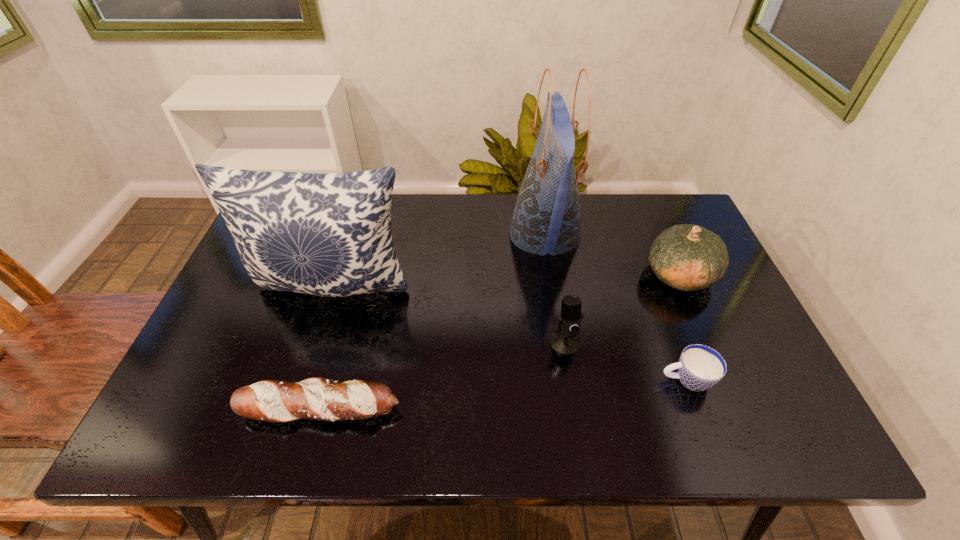
At what (x,y) coordinates should I click in order to perform the action: click on shopping bag. Please return your answer as a coordinate pair (x, y). Looking at the image, I should click on (546, 219).

The height and width of the screenshot is (540, 960). I want to click on cushion, so click(328, 234).

I want to click on gourd, so click(687, 257).

At what (x,y) coordinates should I click in order to perform the action: click on the fourth farthest object. Please return your answer as a coordinate pair (x, y). Looking at the image, I should click on (565, 340).

Where is `baguet`? The width and height of the screenshot is (960, 540). baguet is located at coordinates (317, 398).

This screenshot has width=960, height=540. Identify the location of cup. click(700, 367).

Find the location of a particular element. The width and height of the screenshot is (960, 540). free space located 0.130m on the front of the shopping bag is located at coordinates (556, 309).

Image resolution: width=960 pixels, height=540 pixels. Find the location of `vacant space located on the front surface of the cushion`. vacant space located on the front surface of the cushion is located at coordinates (300, 398).

Where is `free space located on the back of the gourd`? The image size is (960, 540). free space located on the back of the gourd is located at coordinates (644, 193).

The width and height of the screenshot is (960, 540). I want to click on vacant space located 0.140m on the stand of the microphone, so (x=576, y=410).